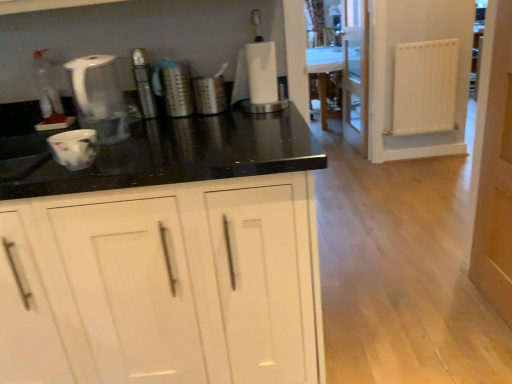
Question: Is white paper towel holder at center, positioned as the 4th appliance in left-to-right order, positioned in front of brushed metal canister at center, acting as the 2th appliance starting from the right?

Choices:
 (A) yes
 (B) no

Answer: (A)

Question: Can you confirm if white paper towel holder at center, positioned as the 4th appliance in left-to-right order, is smaller than brushed metal canister at center, acting as the 2th appliance starting from the right?

Choices:
 (A) no
 (B) yes

Answer: (A)

Question: Is white paper towel holder at center, which is the 1th appliance in right-to-left order, at the left side of brushed metal canister at center, acting as the 2th appliance starting from the right?

Choices:
 (A) no
 (B) yes

Answer: (A)

Question: From the image's perspective, would you say white paper towel holder at center, which is the 1th appliance in right-to-left order, is positioned over brushed metal canister at center, marked as the 3th appliance in a left-to-right arrangement?

Choices:
 (A) no
 (B) yes

Answer: (B)

Question: Is white paper towel holder at center, positioned as the 4th appliance in left-to-right order, outside brushed metal canister at center, acting as the 2th appliance starting from the right?

Choices:
 (A) yes
 (B) no

Answer: (A)

Question: Is white paper towel holder at center, positioned as the 4th appliance in left-to-right order, thinner than brushed metal canister at center, marked as the 3th appliance in a left-to-right arrangement?

Choices:
 (A) yes
 (B) no

Answer: (B)

Question: Does white matte radiator at right have a smaller size compared to wooden door at right?

Choices:
 (A) yes
 (B) no

Answer: (A)

Question: From a real-world perspective, is white matte radiator at right under wooden door at right?

Choices:
 (A) yes
 (B) no

Answer: (A)

Question: Is white matte radiator at right bigger than wooden door at right?

Choices:
 (A) yes
 (B) no

Answer: (B)

Question: Is white matte radiator at right turned away from wooden door at right?

Choices:
 (A) yes
 (B) no

Answer: (B)

Question: Is the depth of white matte radiator at right greater than that of wooden door at right?

Choices:
 (A) yes
 (B) no

Answer: (A)

Question: Does white matte radiator at right contain wooden door at right?

Choices:
 (A) yes
 (B) no

Answer: (B)

Question: Is transparent glass screen door at center turned away from white matte cabinet at center?

Choices:
 (A) no
 (B) yes

Answer: (A)